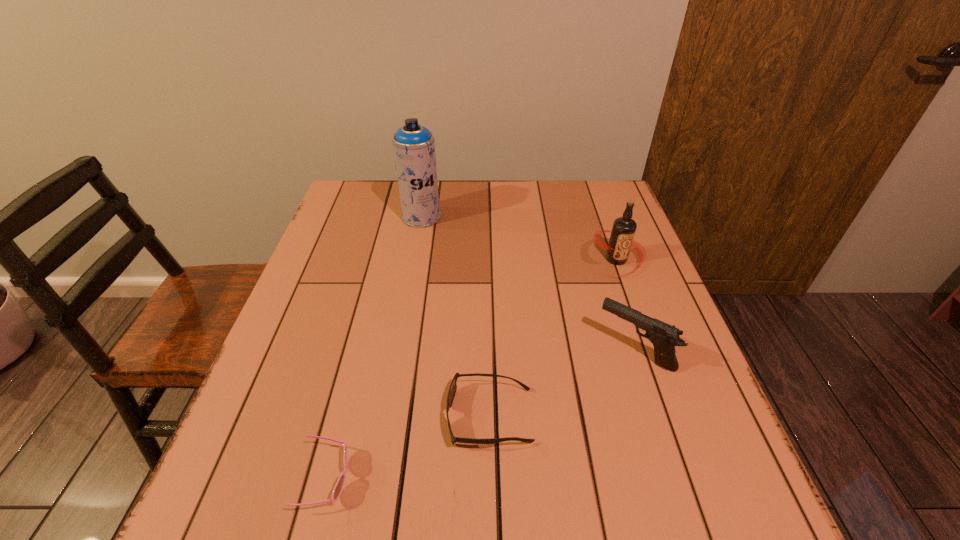
The height and width of the screenshot is (540, 960). In order to click on root beer that is at the right edge in this screenshot , I will do `click(624, 228)`.

This screenshot has width=960, height=540. What are the coordinates of `gun at the right edge` in the screenshot? It's located at (664, 337).

Where is `object that is positioned at the near left corner`? object that is positioned at the near left corner is located at coordinates (338, 488).

Find the location of a particular element. This screenshot has width=960, height=540. vacant space at the far edge of the desktop is located at coordinates (478, 190).

The image size is (960, 540). I want to click on free space at the near edge of the desktop, so click(608, 491).

Locate an element on the screen. The height and width of the screenshot is (540, 960). vacant space at the left edge of the desktop is located at coordinates (276, 390).

Where is `vacant space at the right edge of the desktop`? vacant space at the right edge of the desktop is located at coordinates (660, 397).

At what (x,y) coordinates should I click in order to perform the action: click on free space at the far left corner. Please return your answer as a coordinate pair (x, y). This screenshot has width=960, height=540. Looking at the image, I should click on (388, 190).

Find the location of a particular element. vacant space at the near left corner of the desktop is located at coordinates pos(252,516).

In the image, there is a desktop. Where is `vacant area at the far right corner`? The height and width of the screenshot is (540, 960). vacant area at the far right corner is located at coordinates (577, 202).